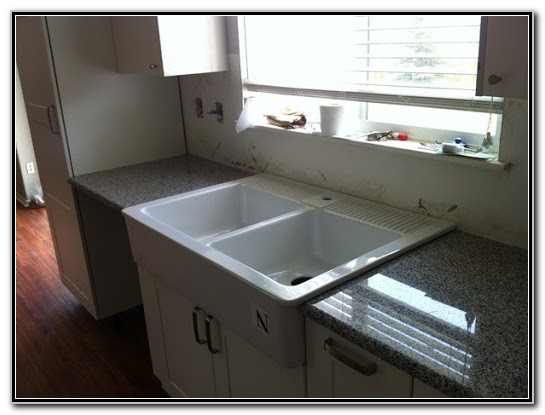
The width and height of the screenshot is (545, 415). What are the coordinates of `reddish brown wood floor` in the screenshot? It's located at (37, 285).